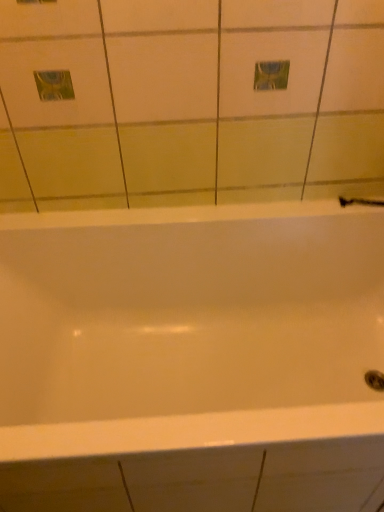
Question: Should I look upward or downward to see white glossy bathtub at center?

Choices:
 (A) down
 (B) up

Answer: (A)

Question: Is white glossy bathtub at center located within white glossy shower at right?

Choices:
 (A) no
 (B) yes

Answer: (A)

Question: From a real-world perspective, is white glossy shower at right positioned over white glossy bathtub at center based on gravity?

Choices:
 (A) yes
 (B) no

Answer: (A)

Question: Is white glossy shower at right touching white glossy bathtub at center?

Choices:
 (A) no
 (B) yes

Answer: (A)

Question: Is white glossy shower at right far from white glossy bathtub at center?

Choices:
 (A) no
 (B) yes

Answer: (A)

Question: From a real-world perspective, is white glossy shower at right physically below white glossy bathtub at center?

Choices:
 (A) yes
 (B) no

Answer: (B)

Question: From the image's perspective, is white glossy shower at right located above white glossy bathtub at center?

Choices:
 (A) yes
 (B) no

Answer: (A)

Question: Could you tell me if white glossy bathtub at center is facing white glossy shower at right?

Choices:
 (A) no
 (B) yes

Answer: (A)

Question: Is white glossy bathtub at center thinner than white glossy shower at right?

Choices:
 (A) no
 (B) yes

Answer: (A)

Question: Is white glossy shower at right completely or partially inside white glossy bathtub at center?

Choices:
 (A) yes
 (B) no

Answer: (A)

Question: Can you confirm if white glossy bathtub at center is bigger than white glossy shower at right?

Choices:
 (A) no
 (B) yes

Answer: (B)

Question: Is white glossy bathtub at center further to the viewer compared to white glossy shower at right?

Choices:
 (A) yes
 (B) no

Answer: (B)

Question: Can you confirm if white glossy bathtub at center is positioned to the right of white glossy shower at right?

Choices:
 (A) yes
 (B) no

Answer: (B)

Question: Which is correct: white glossy shower at right is inside white glossy bathtub at center, or outside of it?

Choices:
 (A) outside
 (B) inside

Answer: (B)